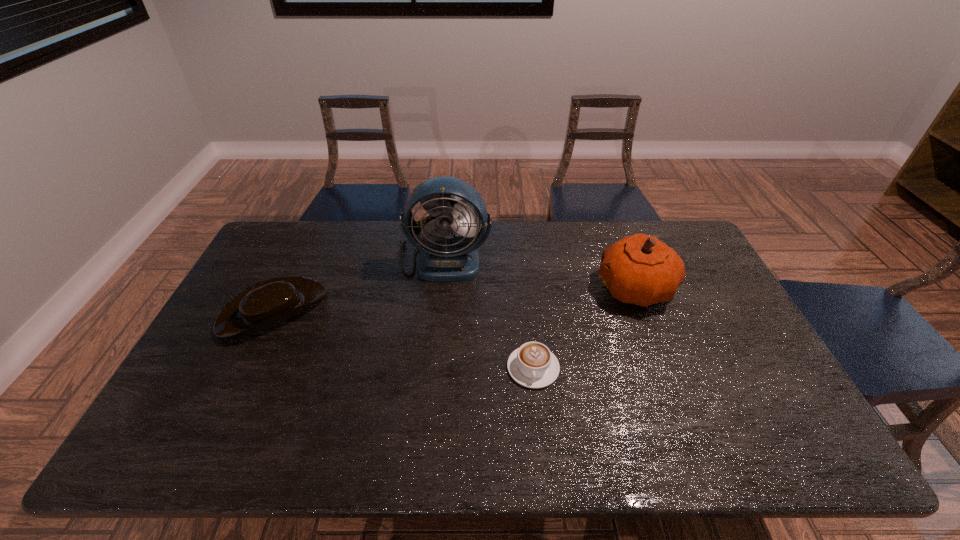
Where is `vacant area situated on the front-facing side of the pumpkin`? The width and height of the screenshot is (960, 540). vacant area situated on the front-facing side of the pumpkin is located at coordinates tap(510, 288).

This screenshot has height=540, width=960. Identify the location of free space located on the front-facing side of the pumpkin. (529, 288).

Where is `vacant space located on the back of the third tallest object`? The image size is (960, 540). vacant space located on the back of the third tallest object is located at coordinates (314, 226).

The height and width of the screenshot is (540, 960). I want to click on vacant space located with the handle on the right side of the shortest object, so click(540, 434).

Identify the location of fan positioned at the far edge. (441, 259).

The image size is (960, 540). In order to click on pumpkin that is positioned at the far edge in this screenshot , I will do `click(643, 270)`.

Where is `object situated at the left edge`? This screenshot has height=540, width=960. object situated at the left edge is located at coordinates (262, 306).

Locate an element on the screen. This screenshot has width=960, height=540. object positioned at the right edge is located at coordinates (643, 270).

The width and height of the screenshot is (960, 540). What are the coordinates of `object at the far right corner` in the screenshot? It's located at (643, 270).

Locate an element on the screen. This screenshot has width=960, height=540. free space at the far edge is located at coordinates coord(556,256).